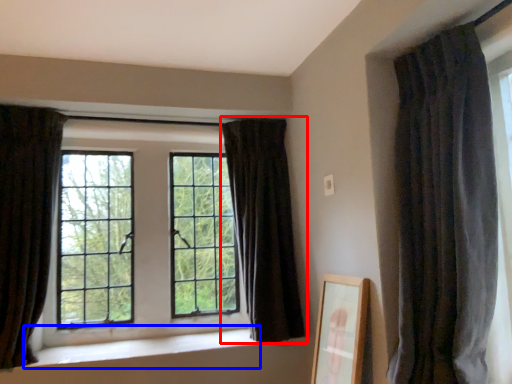
Question: Which of the following is the farthest to the observer, curtain (highlighted by a red box) or window sill (highlighted by a blue box)?

Choices:
 (A) curtain
 (B) window sill

Answer: (A)